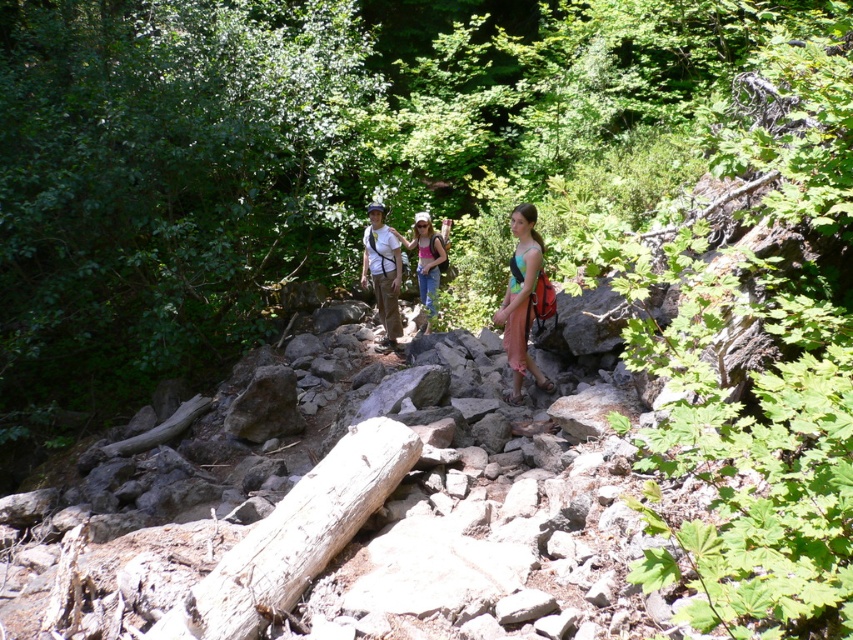
Question: Which of the following is the closest to the observer?

Choices:
 (A) matte pink tank top at center
 (B) multicolored fabric dress at center

Answer: (B)

Question: Can you confirm if multicolored fabric dress at center is bigger than matte pink tank top at center?

Choices:
 (A) no
 (B) yes

Answer: (A)

Question: Which point is farther from the camera taking this photo?

Choices:
 (A) (543, 250)
 (B) (424, 216)

Answer: (B)

Question: Does multicolored fabric dress at center appear over matte pink tank top at center?

Choices:
 (A) yes
 (B) no

Answer: (B)

Question: Does multicolored fabric dress at center appear on the left side of matte pink tank top at center?

Choices:
 (A) no
 (B) yes

Answer: (A)